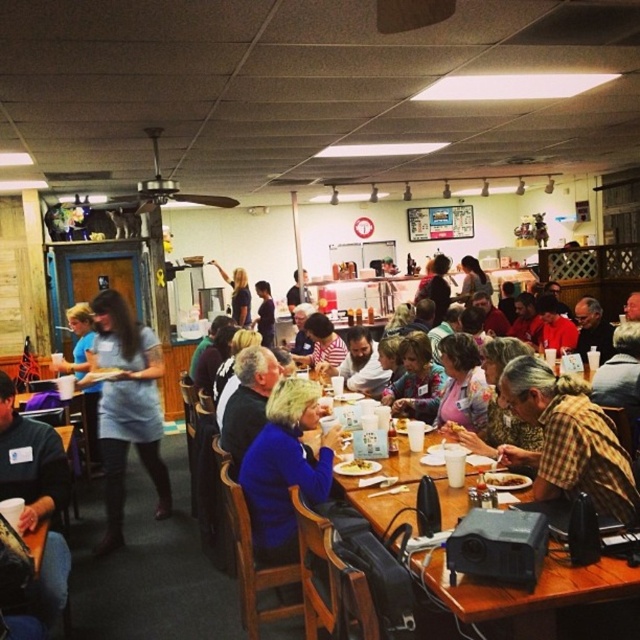
You are a guest at this event and want to reach for the yellow matte plate at center without disturbing the person in the light blue shirt at center. Is the plate currently within your direct line of sight, or is it partially blocked?

The yellow matte plate at center is behind light blue shirt at center, so it is partially blocked by the person in the light blue shirt at center.

You are standing at the entrance of the dining area and want to locate the person wearing the light blue shirt at center. According to the coordinates provided, in which direction should you look relative to your position?

The light blue shirt at center is located at coordinates point (237, 294), which would be in the center of the image. Since you are at the entrance, you should look straight ahead to find the light blue shirt at center.

You are a server at the community center and need to deliver a drink to the person wearing the light blue shirt at center. You are currently standing next to the yellow matte plate at center. Can you reach the person without moving past the table? The table is 2 meters long.

The light blue shirt at center and yellow matte plate at center are 5.71 meters apart. Since the table is only 2 meters long, you would need to move past the table to reach the person, as the distance between them exceeds the table length.